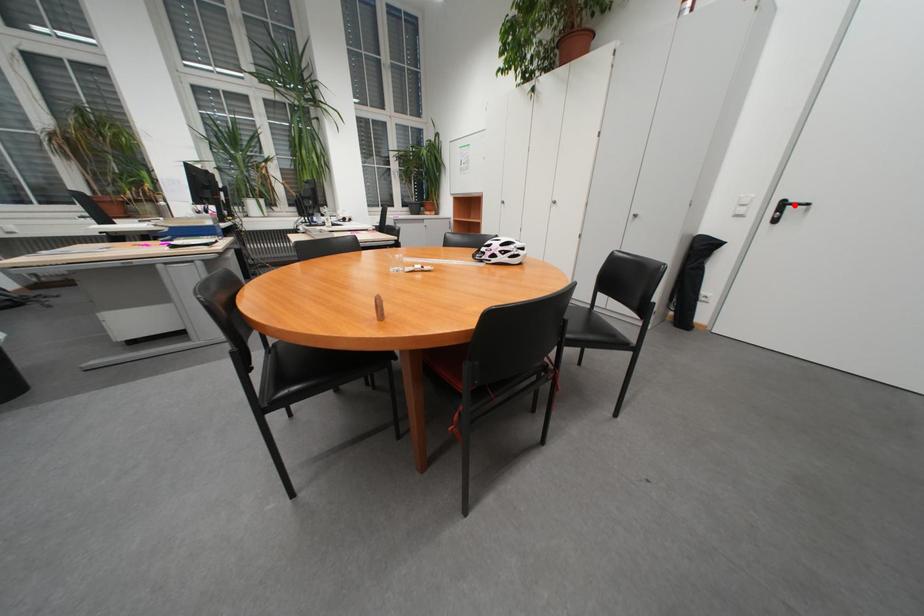
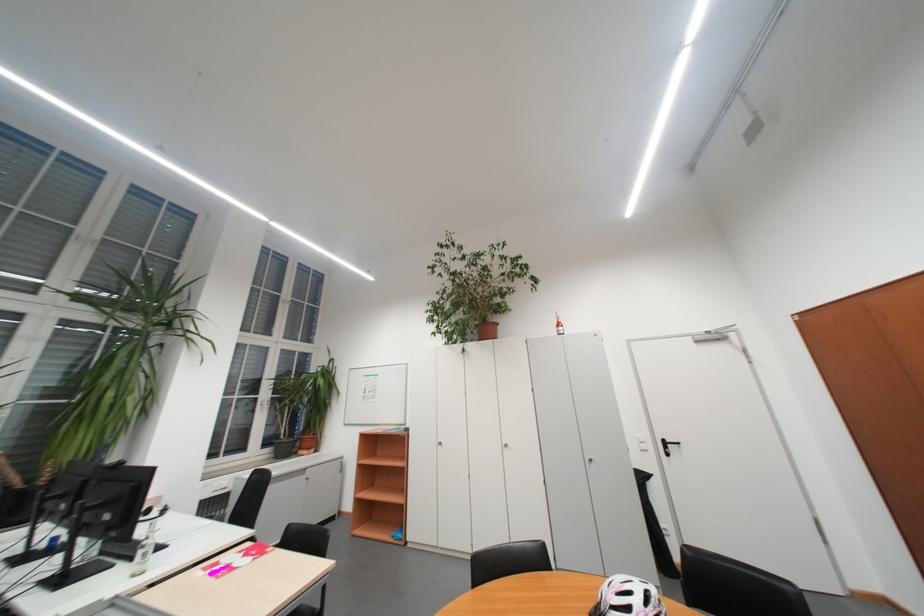
Locate, in the second image, the point that corresponds to the highlighted location in the first image.

(676, 444)